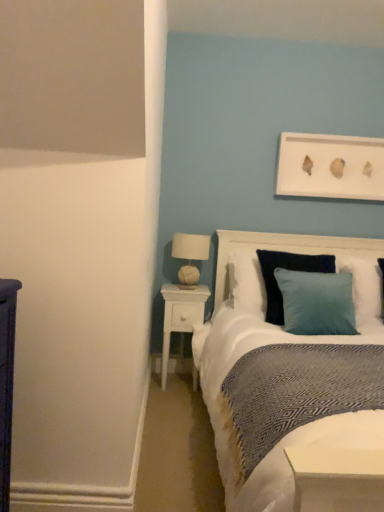
Question: Is white fabric-covered lampshade at upper right taller than white wood nightstand at center?

Choices:
 (A) yes
 (B) no

Answer: (B)

Question: Is white fabric-covered lampshade at upper right positioned with its back to white wood nightstand at center?

Choices:
 (A) no
 (B) yes

Answer: (A)

Question: Considering the relative sizes of white fabric-covered lampshade at upper right and white wood nightstand at center in the image provided, is white fabric-covered lampshade at upper right shorter than white wood nightstand at center?

Choices:
 (A) yes
 (B) no

Answer: (A)

Question: Does white fabric-covered lampshade at upper right have a smaller size compared to white wood nightstand at center?

Choices:
 (A) no
 (B) yes

Answer: (B)

Question: Is the depth of white fabric-covered lampshade at upper right greater than that of white wood nightstand at center?

Choices:
 (A) no
 (B) yes

Answer: (B)

Question: Is white wood nightstand at center in front of or behind teal velvet pillow at center in the image?

Choices:
 (A) behind
 (B) front

Answer: (A)

Question: Is white wood nightstand at center to the left or to the right of teal velvet pillow at center in the image?

Choices:
 (A) left
 (B) right

Answer: (A)

Question: From the image's perspective, is white wood nightstand at center located above or below teal velvet pillow at center?

Choices:
 (A) below
 (B) above

Answer: (A)

Question: Which is correct: white wood nightstand at center is inside teal velvet pillow at center, or outside of it?

Choices:
 (A) inside
 (B) outside

Answer: (B)

Question: Does point (339, 266) appear closer or farther from the camera than point (168, 308)?

Choices:
 (A) farther
 (B) closer

Answer: (A)

Question: From the image's perspective, relative to white wood nightstand at center, is teal velvet pillow at center above or below?

Choices:
 (A) below
 (B) above

Answer: (B)

Question: Is teal velvet pillow at center situated inside white wood nightstand at center or outside?

Choices:
 (A) outside
 (B) inside

Answer: (A)

Question: From a real-world perspective, is teal velvet pillow at center physically located above or below white wood nightstand at center?

Choices:
 (A) above
 (B) below

Answer: (A)

Question: Is white fabric-covered lampshade at upper right spatially inside white wood nightstand at center, or outside of it?

Choices:
 (A) outside
 (B) inside

Answer: (A)

Question: Looking at the image, does white fabric-covered lampshade at upper right seem bigger or smaller compared to white wood nightstand at center?

Choices:
 (A) small
 (B) big

Answer: (A)